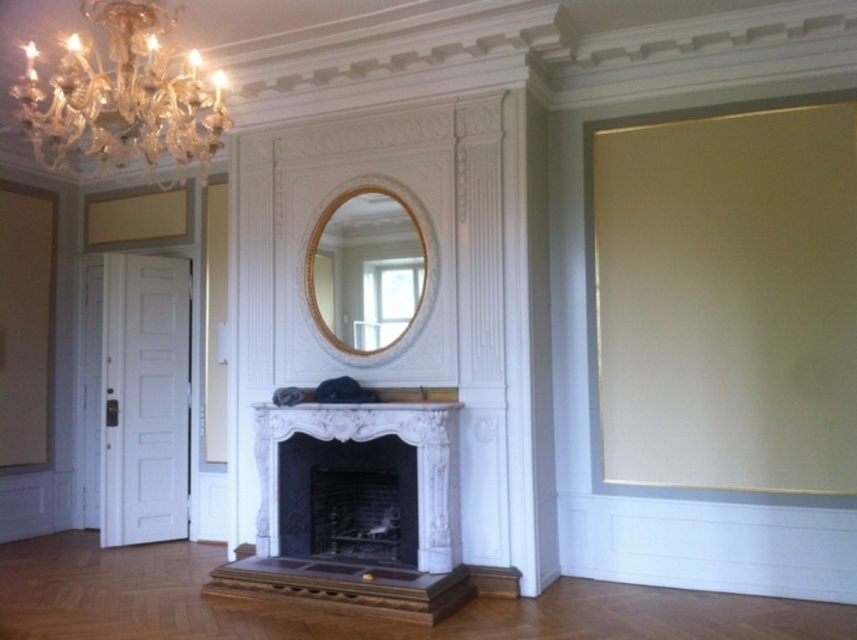
Question: Estimate the real-world distances between objects in this image. Which object is closer to the crystal glass chandelier at upper left?

Choices:
 (A) gold textured mirror at center
 (B) white marble fireplace at center

Answer: (A)

Question: Does white marble fireplace at center appear under dark gray stone fireplace at center?

Choices:
 (A) yes
 (B) no

Answer: (A)

Question: Among these objects, which one is nearest to the camera?

Choices:
 (A) white marble fireplace at center
 (B) crystal glass chandelier at upper left

Answer: (B)

Question: Which object is positioned farthest from the dark gray stone fireplace at center?

Choices:
 (A) white marble fireplace at center
 (B) crystal glass chandelier at upper left

Answer: (B)

Question: Does white marble fireplace at center have a smaller size compared to crystal glass chandelier at upper left?

Choices:
 (A) yes
 (B) no

Answer: (B)

Question: Does white marble fireplace at center appear on the right side of gold textured mirror at center?

Choices:
 (A) no
 (B) yes

Answer: (A)